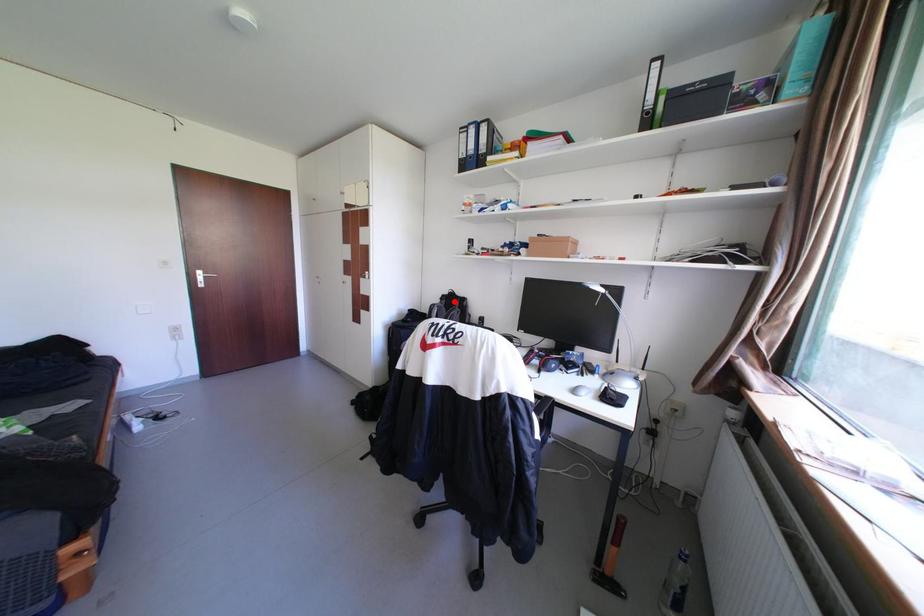
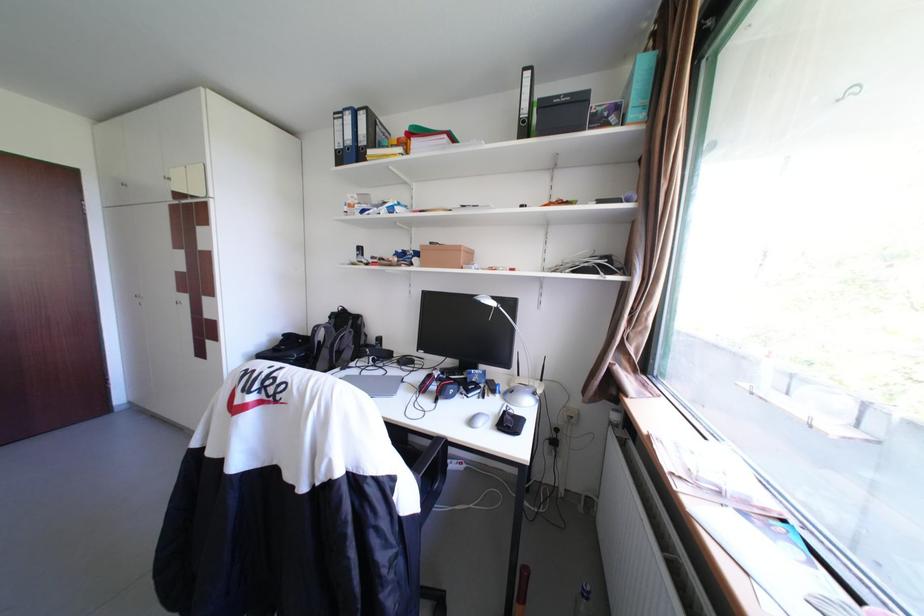
Find the pixel in the second image that matches the highlighted location in the first image.

(344, 321)